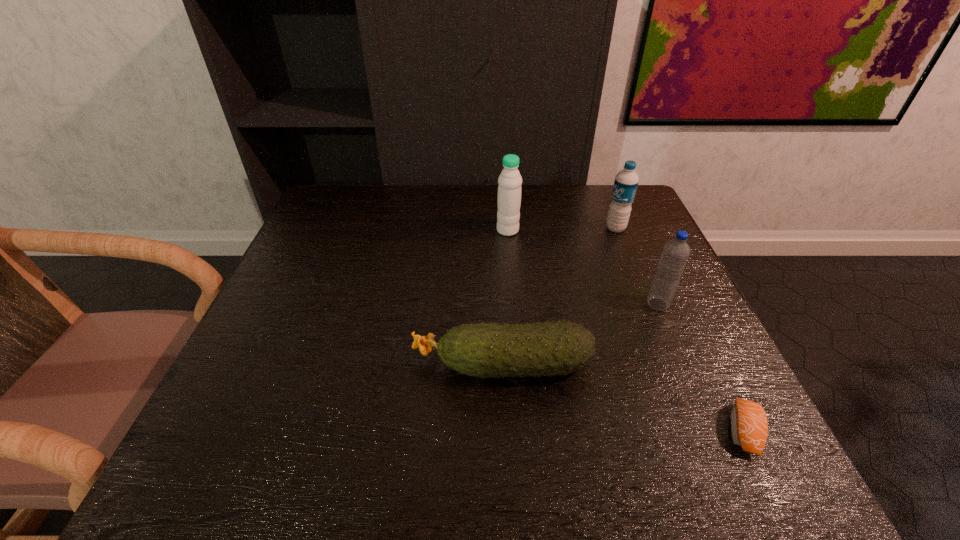
Where is `free location at the far right corner of the desktop`? Image resolution: width=960 pixels, height=540 pixels. free location at the far right corner of the desktop is located at coordinates (638, 201).

I want to click on free point between the sushi and the leftmost water bottle, so click(626, 330).

I want to click on free area in between the cucumber and the leftmost water bottle, so click(x=505, y=298).

At what (x,y) coordinates should I click in order to perform the action: click on free space that is in between the leftmost water bottle and the nearest water bottle. Please return your answer as a coordinate pair (x, y). The width and height of the screenshot is (960, 540). Looking at the image, I should click on (583, 267).

Find the location of `free point between the sushi and the cucumber`. free point between the sushi and the cucumber is located at coordinates (623, 398).

This screenshot has height=540, width=960. Identify the location of vacant space that's between the cucumber and the leftmost water bottle. (505, 298).

Identify which object is the closest to the leftmost water bottle. Please provide its 2D coordinates. Your answer should be formatted as a tuple, i.e. [(x, y)], where the tuple contains the x and y coordinates of a point satisfying the conditions above.

[(626, 181)]

I want to click on object that is the closest to the leftmost water bottle, so click(626, 181).

Point out which water bottle is positioned as the nearest to the third nearest object. Please provide its 2D coordinates. Your answer should be formatted as a tuple, i.e. [(x, y)], where the tuple contains the x and y coordinates of a point satisfying the conditions above.

[(626, 181)]

Image resolution: width=960 pixels, height=540 pixels. Identify the location of water bottle identified as the third closest to the nearest object. (509, 189).